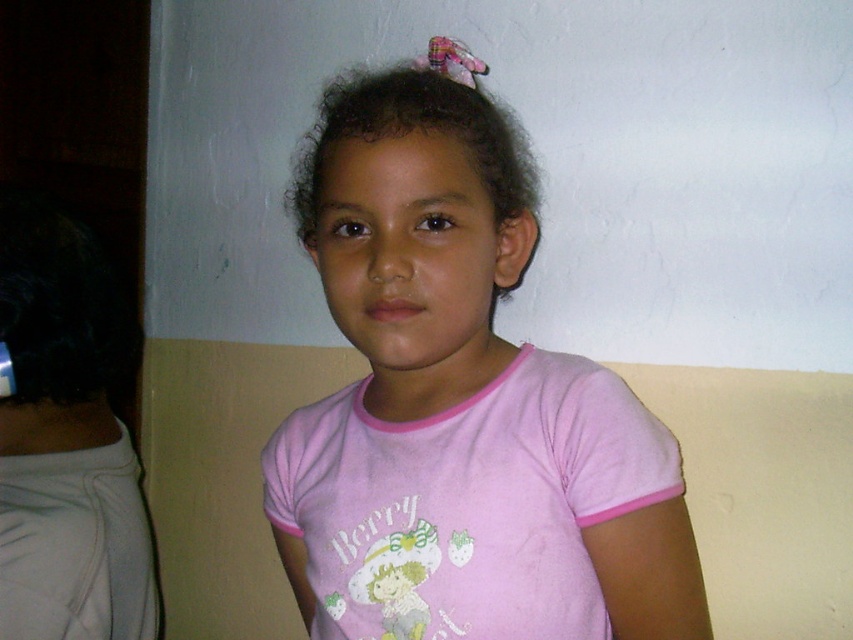
Question: Is pink cotton shirt at center smaller than white fabric at left?

Choices:
 (A) yes
 (B) no

Answer: (B)

Question: Which object appears closest to the camera in this image?

Choices:
 (A) dark curly hair at center
 (B) pink cotton shirt at center

Answer: (B)

Question: Is white fabric at left wider than dark curly hair at center?

Choices:
 (A) no
 (B) yes

Answer: (A)

Question: Among these objects, which one is nearest to the camera?

Choices:
 (A) white fabric at left
 (B) dark curly hair at center

Answer: (B)

Question: Is pink cotton shirt at center above white fabric at left?

Choices:
 (A) no
 (B) yes

Answer: (B)

Question: Which point is farther to the camera?

Choices:
 (A) dark curly hair at center
 (B) white fabric at left
 (C) pink cotton shirt at center

Answer: (B)